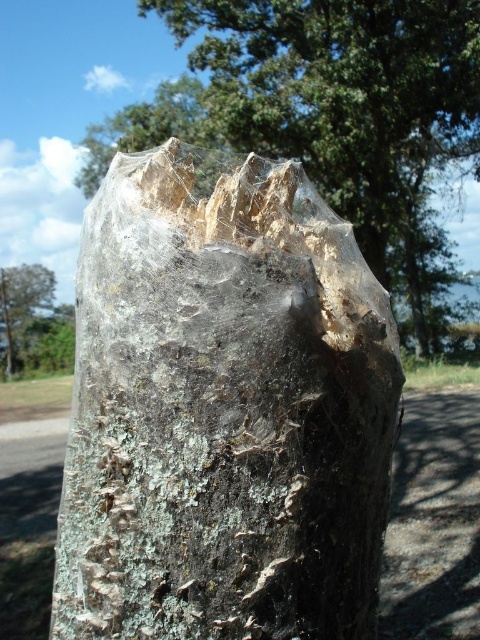
You are a park ranger inspecting a tree trunk. You need to locate the transparent plastic tree trunk at center. Where exactly is it located in the image?

The transparent plastic tree trunk at center is located at point (224, 412).

You are a gardener trying to determine which object is wider between the transparent plastic tree trunk at center and the translucent plastic bag at center. Based on the scene, which one has a greater width?

The transparent plastic tree trunk at center has a greater width than the translucent plastic bag at center.